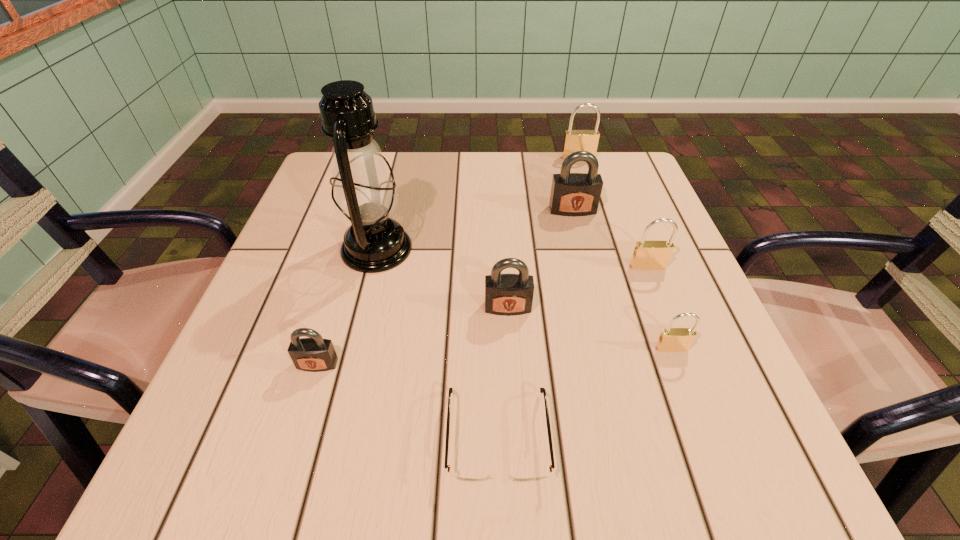
Locate an element on the screen. This screenshot has width=960, height=540. the closest gray padlock relative to the oil lamp is located at coordinates (508, 294).